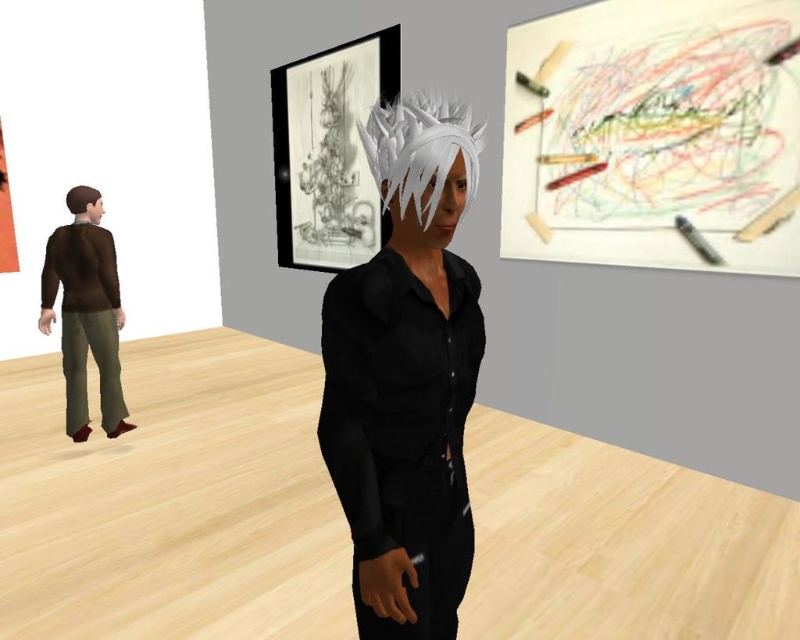
You are an artist in the gallery and need to decide which object to use first. The colored crayons at upper right and the brown fabric pants at left are both in your view. Which object is wider?

The colored crayons at upper right are wider than the brown fabric pants at left.

You are an artist in the gallery and need to reach the colored crayons at upper right. The point marked at point (654,134) indicates their location. Can you walk directly from your current position to the colored crayons at upper right without passing through any walls?

The point (654,134) marks the colored crayons at upper right, so yes, you can walk directly to them as there are no walls blocking the path between your current position and the colored crayons at upper right.

You are a security guard in the art gallery. You notice two visitors with distinct hairstyles. One has white matte hair at center and the other has brown matte hair at left. Which visitor has a hairstyle that reaches higher up in the air?

The white matte hair at center reaches higher up in the air because it is taller than the brown matte hair at left.